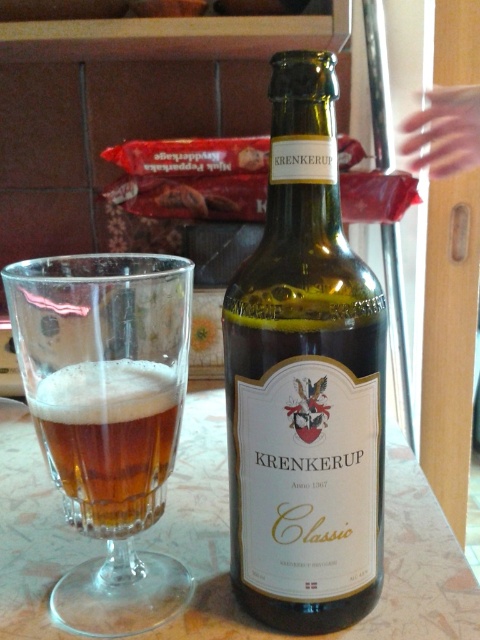
Based on the photo, does green glass bottle at center appear on the left side of transparent glass at center?

In fact, green glass bottle at center is to the right of transparent glass at center.

In the scene shown: Can you confirm if green glass bottle at center is positioned below transparent glass at center?

Actually, green glass bottle at center is above transparent glass at center.

Between point (330, 77) and point (105, 292), which one is positioned behind?

The point (105, 292) is behind.

I want to click on green glass bottle at center, so click(x=304, y=381).

Which of these two, green glass bottle at center or amber glass beer at center, stands shorter?

amber glass beer at center is shorter.

Between point (337, 193) and point (136, 400), which one is positioned in front?

Point (337, 193)

Where is `green glass bottle at center`? This screenshot has height=640, width=480. green glass bottle at center is located at coordinates (304, 381).

Who is lower down, transparent glass at center or amber glass beer at center?

amber glass beer at center

Who is positioned more to the right, transparent glass at center or amber glass beer at center?

Positioned to the right is amber glass beer at center.

The image size is (480, 640). Describe the element at coordinates (108, 419) in the screenshot. I see `transparent glass at center` at that location.

Find the location of `transparent glass at center`. transparent glass at center is located at coordinates (108, 419).